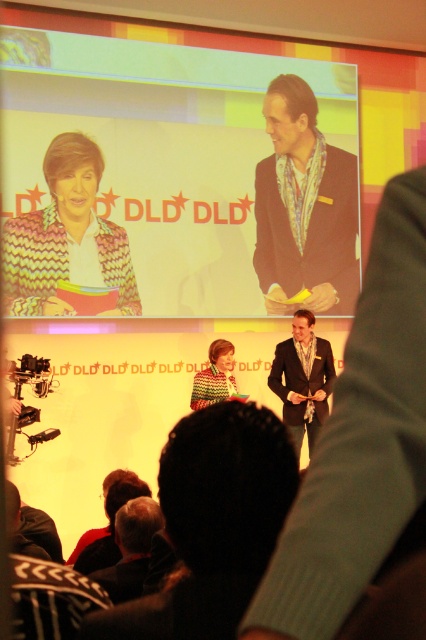
In the scene shown: You are an event organizer who needs to place a 1.5 meter wide banner between the patterned fabric suit at center and the dark brown leather jacket at lower left. Is there enough space for the banner?

The distance between the patterned fabric suit at center and dark brown leather jacket at lower left is 1.25 meters, which is less than the banner width of 1.5 meters. Therefore, there is not enough space for the banner.

You are an event organizer who needs to arrange a photo shoot. You want to place a 10 feet wide banner between the dark brown leather jacket at lower left and the knitted sweater at center. Will there be enough space for the banner?

The dark brown leather jacket at lower left is 11.69 feet from the knitted sweater at center. Since the banner is 10 feet wide, there is enough space to place it between them.